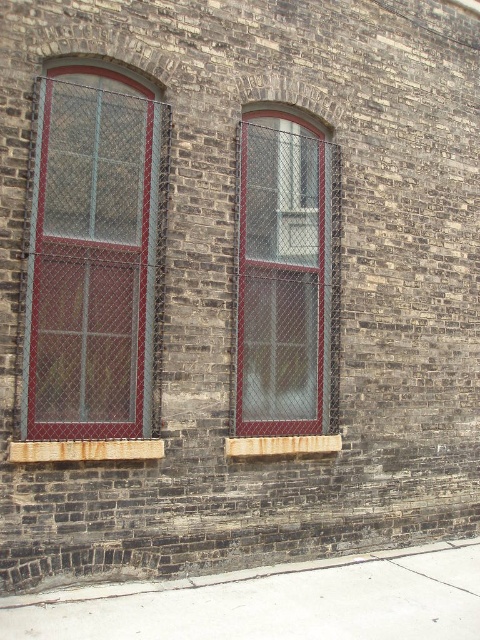
Question: Considering the relative positions of matte glass window at left and gray concrete pavement at lower center in the image provided, where is matte glass window at left located with respect to gray concrete pavement at lower center?

Choices:
 (A) below
 (B) above

Answer: (B)

Question: Which point is farther to the camera?

Choices:
 (A) pyautogui.click(x=229, y=451)
 (B) pyautogui.click(x=136, y=454)
 (C) pyautogui.click(x=300, y=145)

Answer: (C)

Question: Which object is positioned closest to the wooden at lower center?

Choices:
 (A) matte glass window at center
 (B) wooden at lower left

Answer: (B)

Question: Can you confirm if matte glass window at left is positioned to the left of wooden at lower left?

Choices:
 (A) yes
 (B) no

Answer: (A)

Question: Which object is positioned closest to the gray concrete pavement at lower center?

Choices:
 (A) wooden at lower center
 (B) matte glass window at left

Answer: (A)

Question: Does gray concrete pavement at lower center appear on the left side of matte glass window at center?

Choices:
 (A) no
 (B) yes

Answer: (A)